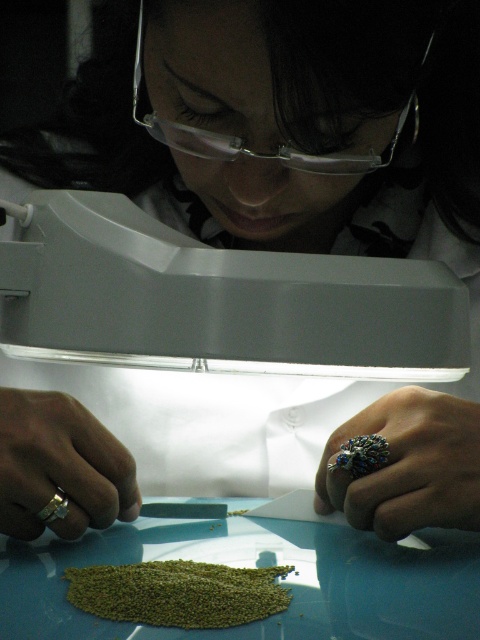
Is point (452, 433) positioned after point (72, 403)?

No, (452, 433) is in front of (72, 403).

Identify the location of silver metallic ring at lower right. (408, 465).

Between gold ring at lower left and clear plastic goggles at upper center, which one is positioned higher?

clear plastic goggles at upper center

Between point (14, 394) and point (146, 113), which one is positioned in front?

Positioned in front is point (14, 394).

Where is `gold ring at lower left`? gold ring at lower left is located at coordinates click(x=60, y=467).

Is silver metallic ring at lower right above clear plastic goggles at upper center?

No, silver metallic ring at lower right is not above clear plastic goggles at upper center.

Does silver metallic ring at lower right come in front of clear plastic goggles at upper center?

No, it is not.

You are a GUI agent. You are given a task and a screenshot of the screen. Output one action in this format:
    pyautogui.click(x=<x>, y=<y>)
    Task: Click on the silver metallic ring at lower right
    The height and width of the screenshot is (640, 480).
    Given the screenshot: What is the action you would take?
    pyautogui.click(x=408, y=465)